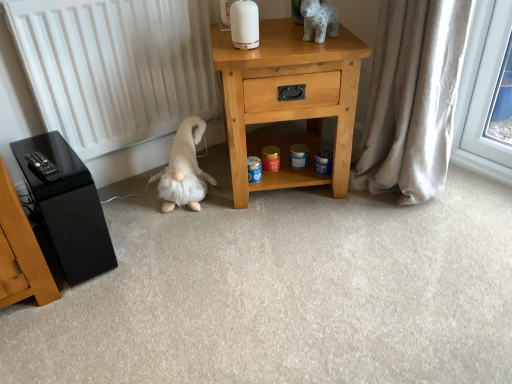
The width and height of the screenshot is (512, 384). Identify the location of vacant space behind black glossy speaker at left. (119, 208).